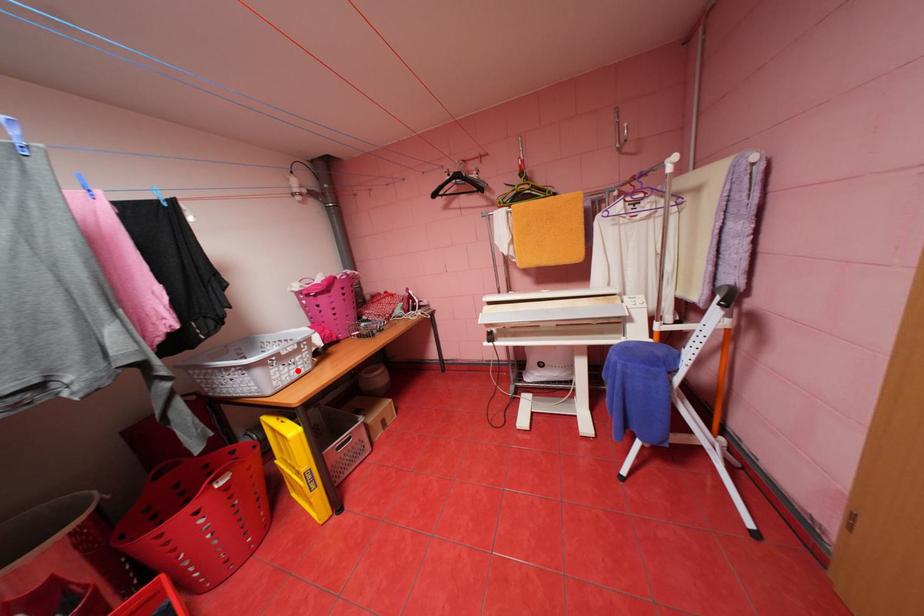
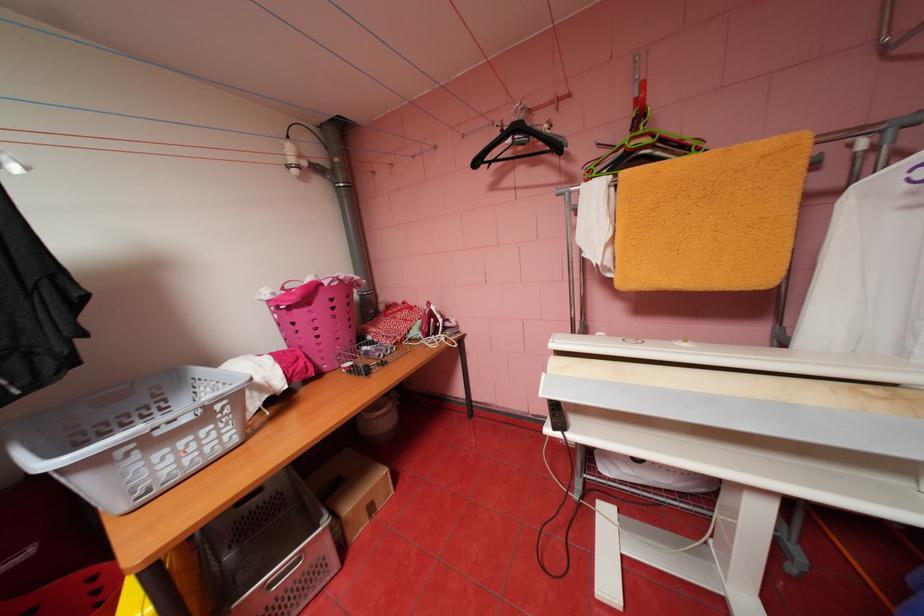
Question: I am providing you with two images of the same scene from different viewpoints. Image1 has a red point marked. In image2, the corresponding 3D location appears at what relative position? Reply with the corresponding letter.

Choices:
 (A) Closer
 (B) Farther

Answer: (B)